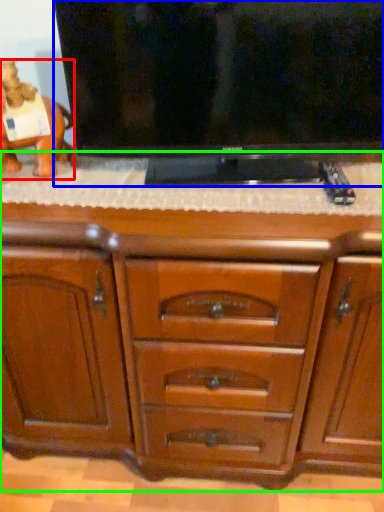
Question: Which object is the farthest from animal (highlighted by a red box)? Choose among these: television (highlighted by a blue box) or chest of drawers (highlighted by a green box).

Choices:
 (A) television
 (B) chest of drawers

Answer: (B)